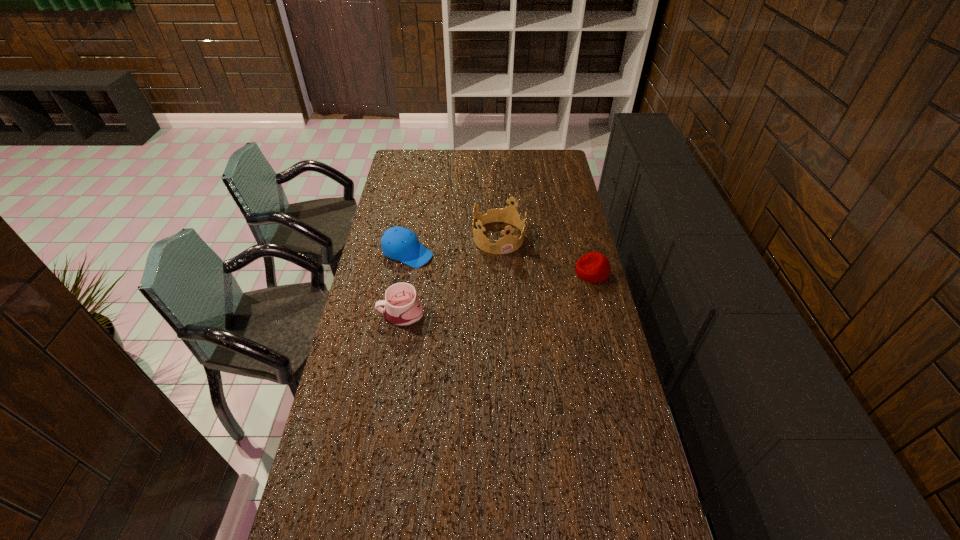
Locate an element on the screen. the nearest object is located at coordinates (402, 308).

You are a GUI agent. You are given a task and a screenshot of the screen. Output one action in this format:
    pyautogui.click(x=<x>, y=<y>)
    Task: Click on the beanbag
    
    Given the screenshot: What is the action you would take?
    pyautogui.click(x=593, y=267)

Identify the location of the shortest object. click(x=593, y=267).

Find the location of a particular element. The image size is (960, 540). the tallest object is located at coordinates (507, 244).

Identify the location of the second object from right to left. The height and width of the screenshot is (540, 960). (507, 244).

Where is `cap`? cap is located at coordinates (398, 243).

Locate an element on the screen. free space located on the seat area of the rightmost object is located at coordinates (502, 272).

You are a GUI agent. You are given a task and a screenshot of the screen. Output one action in this format:
    pyautogui.click(x=<x>, y=<y>)
    Task: Click on the vacant area situated on the seat area of the rightmost object
    
    Given the screenshot: What is the action you would take?
    pyautogui.click(x=520, y=272)

Identify the location of vacant position located on the seat area of the rightmost object. This screenshot has height=540, width=960. (535, 272).

Where is `vacant space located on the front-facing side of the third object from left to right`? vacant space located on the front-facing side of the third object from left to right is located at coordinates (544, 321).